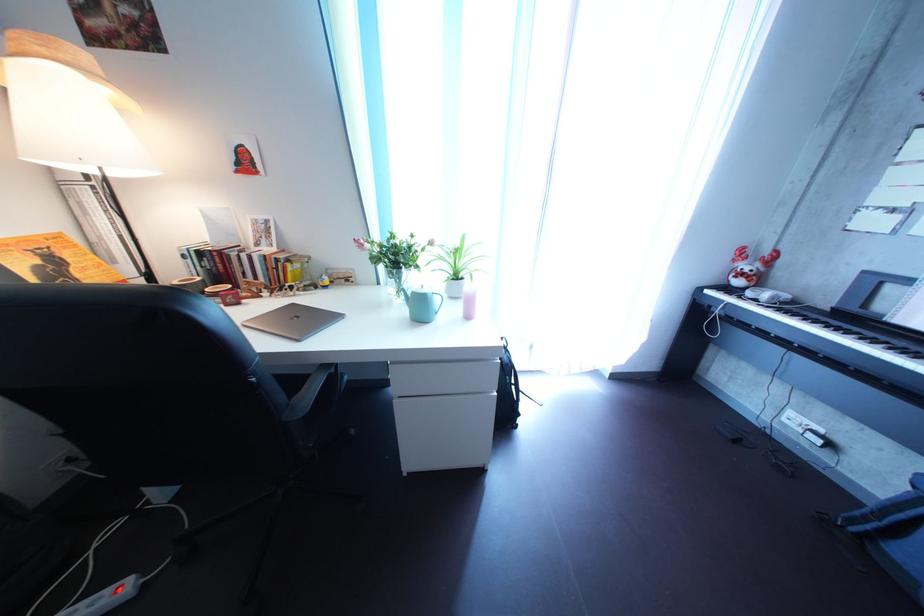
Identify the location of black keyboard key. This screenshot has height=616, width=924. (825, 337).